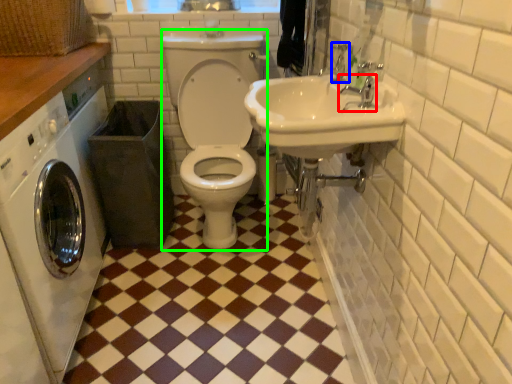
Question: Which object is the farthest from tap (highlighted by a red box)? Choose among these: faucet (highlighted by a blue box) or squat (highlighted by a green box).

Choices:
 (A) faucet
 (B) squat

Answer: (B)